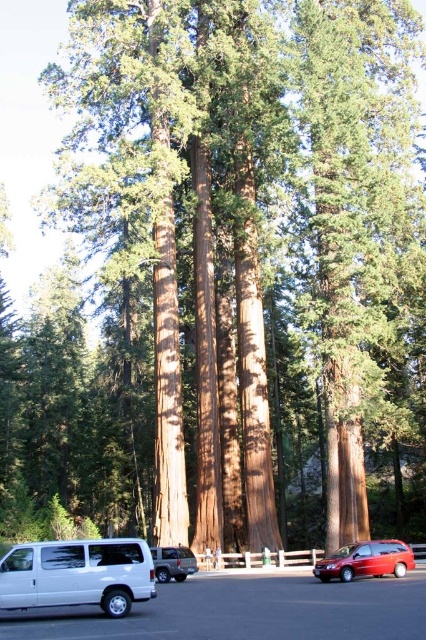
You are standing at the point with coordinates point (377, 563) and want to walk to the point with coordinates point (89, 552). Which direction should you face to walk towards your destination?

You should face north because point (89, 552) is in front of point (377, 563), indicating it is located north of your current position.